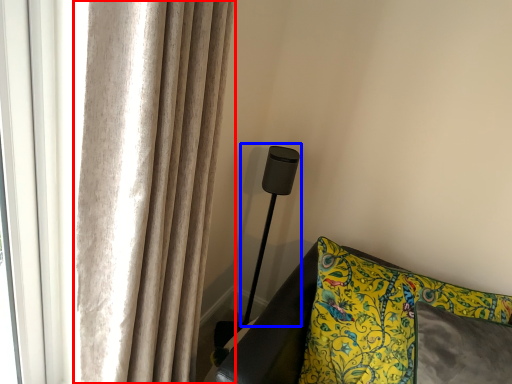
Question: Which object appears farthest to the camera in this image, curtain (highlighted by a red box) or table lamp (highlighted by a blue box)?

Choices:
 (A) curtain
 (B) table lamp

Answer: (B)